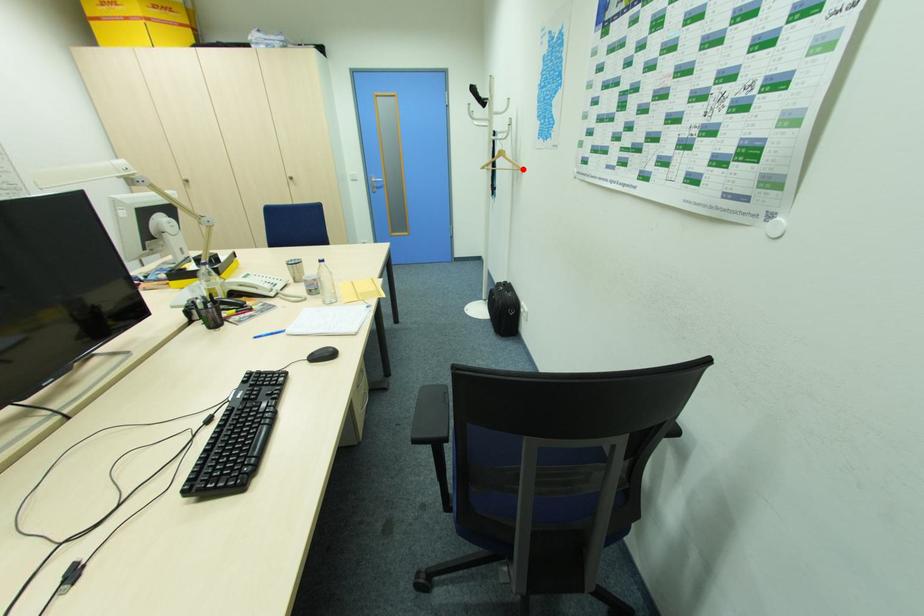
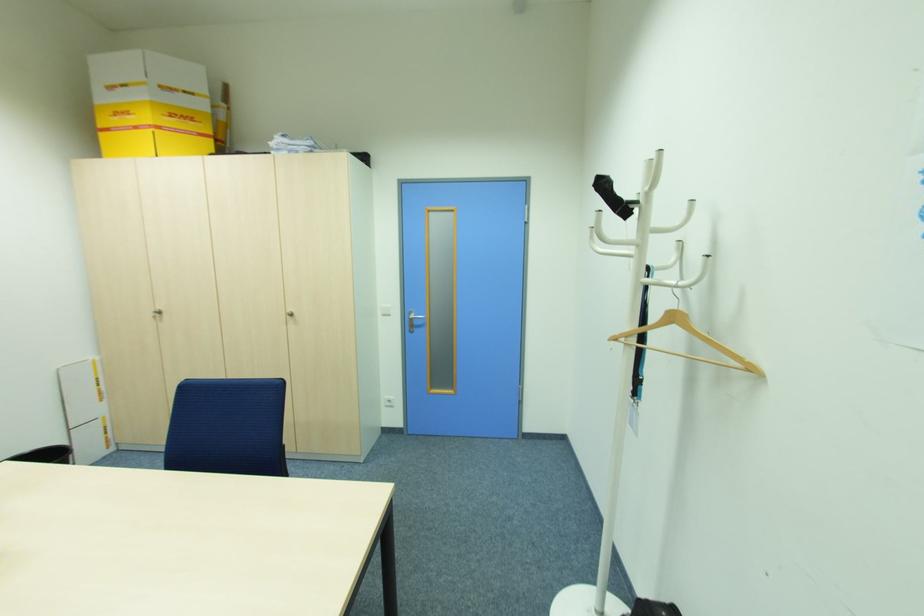
Question: I am providing you with two images of the same scene from different viewpoints. Image1 has a red point marked. In image2, the corresponding 3D location appears at what relative position? Reply with the corresponding letter.

Choices:
 (A) Closer
 (B) Farther

Answer: (B)